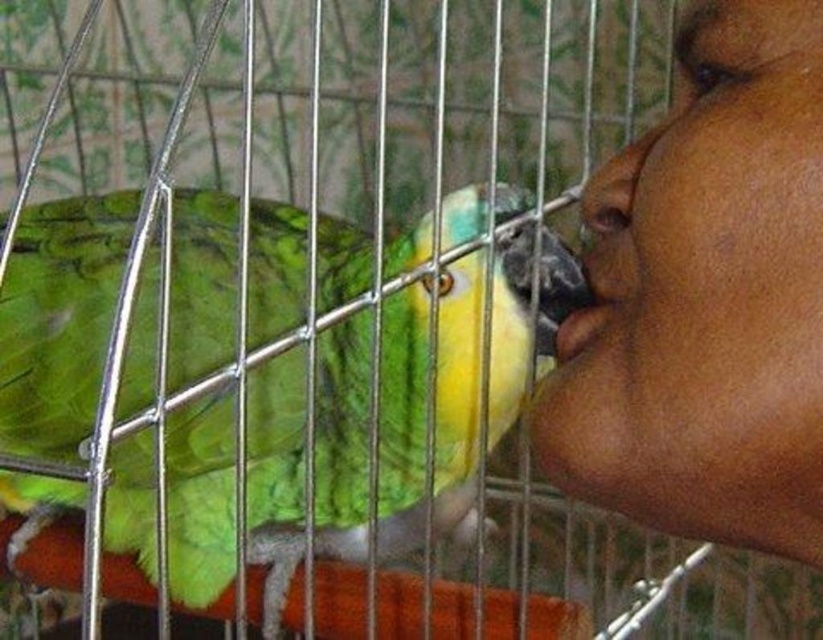
Question: Which is farther from the matte skin nose at right?

Choices:
 (A) smooth skin at mouth right
 (B) smooth skin face at upper right
 (C) green feathered parrot at left

Answer: (C)

Question: Which object is the farthest from the smooth skin face at upper right?

Choices:
 (A) smooth skin at mouth right
 (B) matte skin nose at right

Answer: (A)

Question: Can you confirm if green feathered parrot at left is thinner than matte skin nose at right?

Choices:
 (A) no
 (B) yes

Answer: (A)

Question: Considering the relative positions of green feathered parrot at left and smooth skin at mouth right in the image provided, where is green feathered parrot at left located with respect to smooth skin at mouth right?

Choices:
 (A) above
 (B) below

Answer: (B)

Question: Does smooth skin face at upper right have a greater width compared to matte skin nose at right?

Choices:
 (A) no
 (B) yes

Answer: (B)

Question: Which point is closer to the camera?

Choices:
 (A) matte skin nose at right
 (B) smooth skin face at upper right
 (C) smooth skin at mouth right
 (D) green feathered parrot at left

Answer: (B)